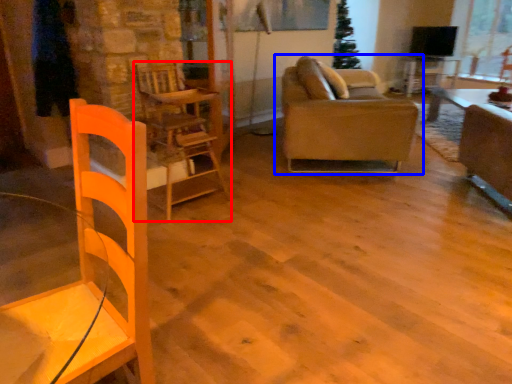
Question: Among these objects, which one is farthest to the camera, chair (highlighted by a red box) or studio couch (highlighted by a blue box)?

Choices:
 (A) chair
 (B) studio couch

Answer: (B)